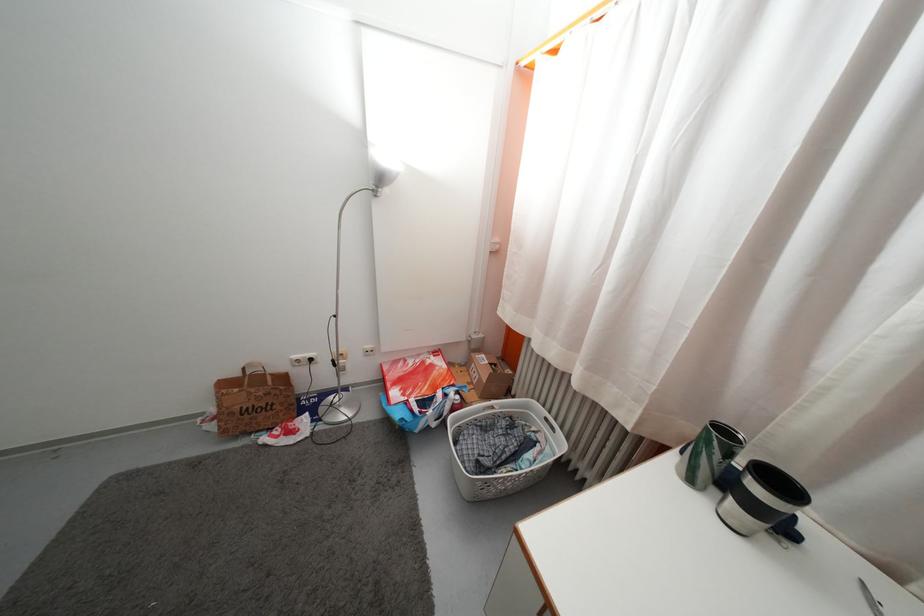
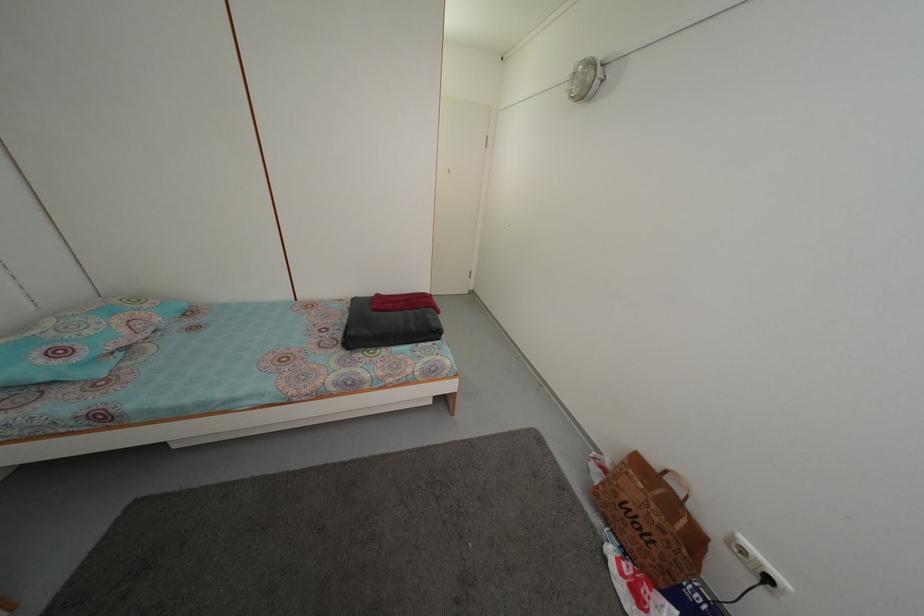
In the second image, find the point that corresponds to point 299,373 in the first image.

(733, 551)